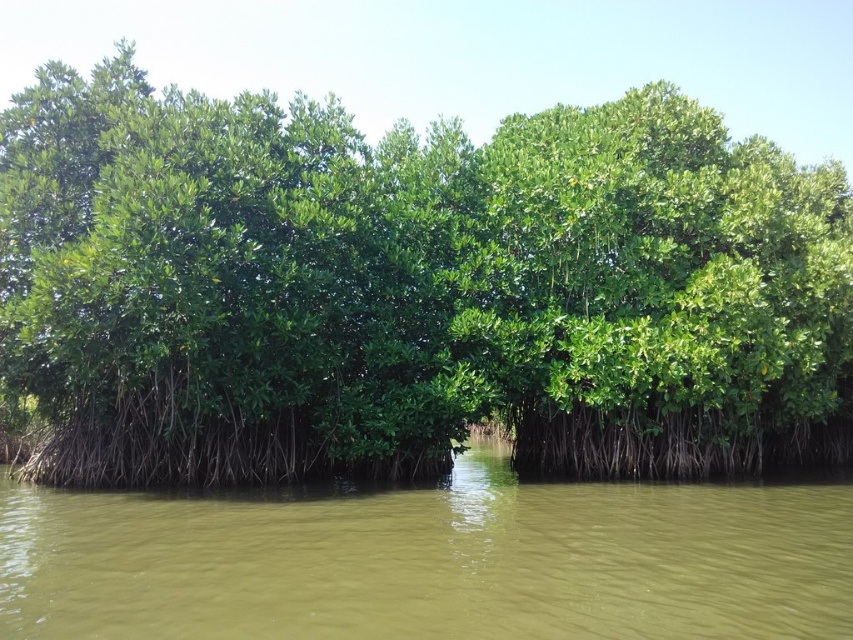
Question: Which point is farther to the camera?

Choices:
 (A) (38, 588)
 (B) (616, 192)

Answer: (B)

Question: Can you confirm if green leafy mangrove at center is wider than green muddy water at center?

Choices:
 (A) no
 (B) yes

Answer: (B)

Question: In this image, where is green leafy mangrove at center located relative to green muddy water at center?

Choices:
 (A) below
 (B) above

Answer: (B)

Question: Which of the following is the closest to the observer?

Choices:
 (A) (172, 552)
 (B) (625, 184)

Answer: (A)

Question: In this image, where is green leafy mangrove at center located relative to green muddy water at center?

Choices:
 (A) right
 (B) left

Answer: (B)

Question: Which of the following is the closest to the observer?

Choices:
 (A) (606, 627)
 (B) (560, 108)

Answer: (A)